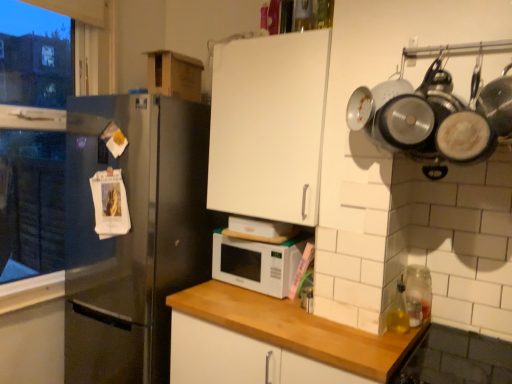
You are a GUI agent. You are given a task and a screenshot of the screen. Output one action in this format:
    pyautogui.click(x=<x>, y=<y>)
    Task: Click on the free region on the left part of translucent yellow glass at right
    This screenshot has width=512, height=384.
    Given the screenshot: What is the action you would take?
    pyautogui.click(x=354, y=330)